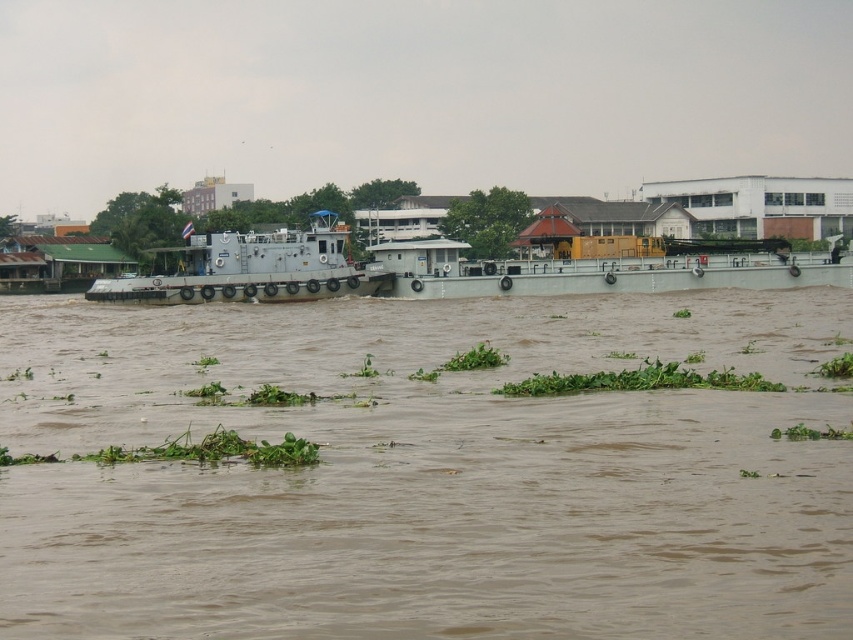
You are a river pilot observing the gray metallic barge at center and the gray metallic tugboat at center from the riverbank. Which vessel is positioned to the east side of the other?

The gray metallic barge at center is to the right of the gray metallic tugboat at center. Since the observer is on the riverbank, the right side corresponds to the east direction. Therefore, the gray metallic barge at center is positioned to the east side of the gray metallic tugboat at center.

You are a captain of a small boat that is 2 meters wide. You want to pass through the area between the brown muddy water at center and the gray metallic tugboat at center. Can your boat fit through the space?

The brown muddy water at center is wider than the gray metallic tugboat at center, so the space between them is sufficient for your 2 meter wide boat to pass through.